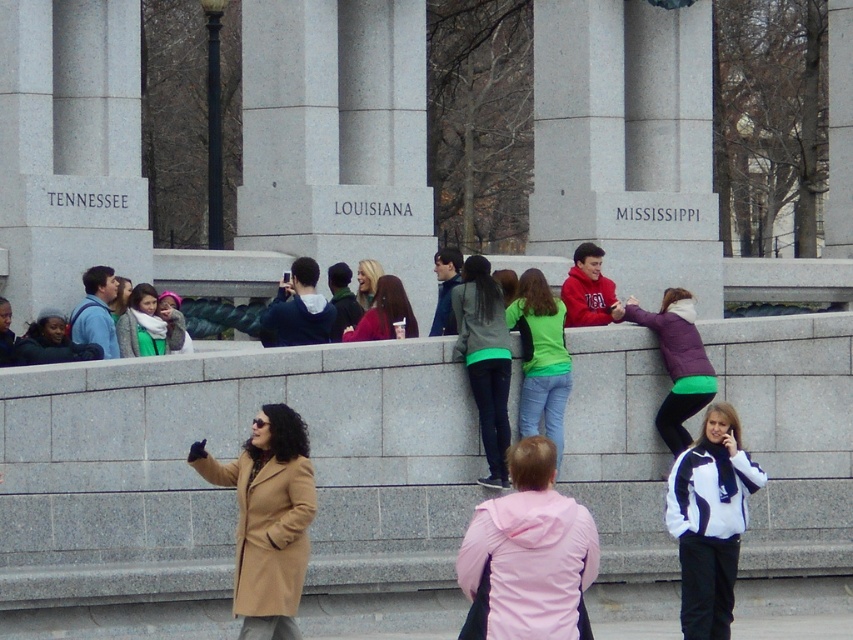
Looking at this image, you are standing in front of the monument and notice two points marked on the monument. The first point is at coordinates point (242,35) and the second is at point (181,349). Which point is closer to you?

Point (242,35) is further to the camera than point (181,349), so the point closer to you is point (181,349).

You are standing in front of the monument and see two points marked on it. Which point is closer to you, point (x=685, y=102) or point (x=680, y=291)?

Point (x=685, y=102) is closer to you because it is further to the viewer than point (x=680, y=291).